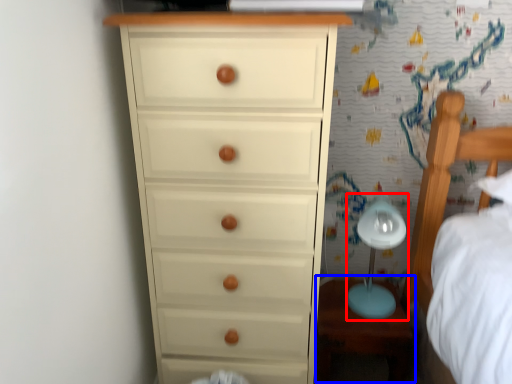
Question: Which of the following is the closest to the observer, table lamp (highlighted by a red box) or table (highlighted by a blue box)?

Choices:
 (A) table lamp
 (B) table

Answer: (A)